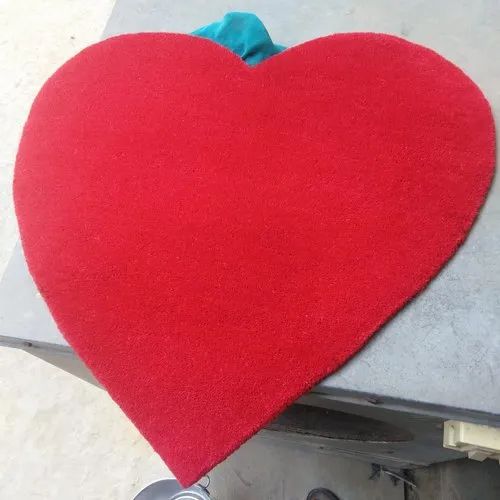
Locate an element on the screen. The width and height of the screenshot is (500, 500). blue cloth is located at coordinates click(x=248, y=37).